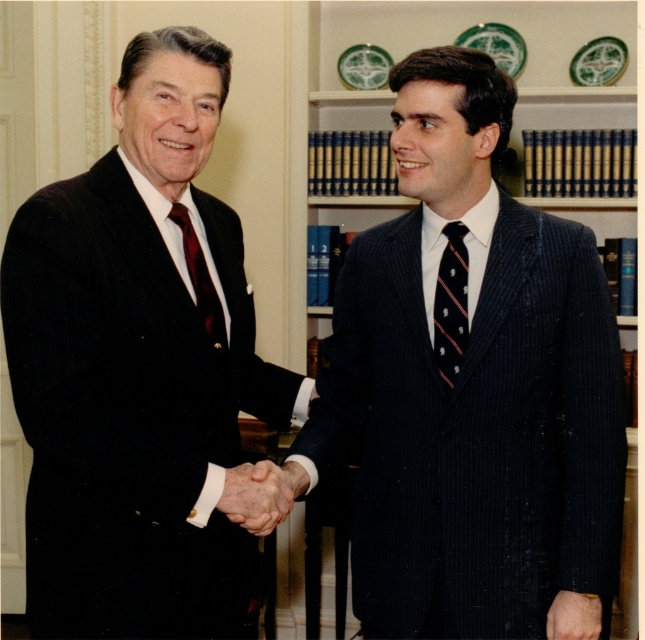
Can you confirm if striped silk tie at right is positioned above smooth skin handshake at center?

Indeed, striped silk tie at right is positioned over smooth skin handshake at center.

Between striped silk tie at right and smooth skin handshake at center, which one appears on the right side from the viewer's perspective?

striped silk tie at right

Is point (453, 312) positioned behind point (270, 468)?

Yes, point (453, 312) is farther from viewer.

This screenshot has height=640, width=645. What are the coordinates of `striped silk tie at right` in the screenshot? It's located at (450, 305).

Can you confirm if smooth skin handshake at center is bigger than smooth skin hand at lower right?

Correct, smooth skin handshake at center is larger in size than smooth skin hand at lower right.

Based on the photo, is smooth skin handshake at center below smooth skin hand at lower right?

Actually, smooth skin handshake at center is above smooth skin hand at lower right.

Between point (255, 504) and point (588, 596), which one is positioned in front?

Point (255, 504) is in front.

The width and height of the screenshot is (645, 640). What are the coordinates of `smooth skin handshake at center` in the screenshot? It's located at (255, 496).

Between point (470, 77) and point (450, 326), which one is positioned in front?

Point (470, 77)

Is point (611, 518) closer to camera compared to point (452, 276)?

Yes, point (611, 518) is in front of point (452, 276).

This screenshot has height=640, width=645. I want to click on pinstriped suit at center, so click(470, 385).